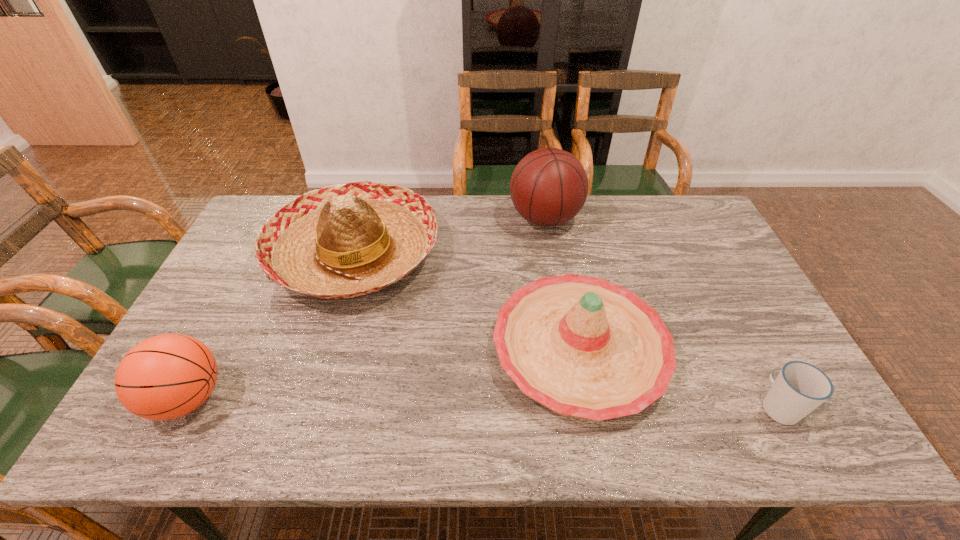
What are the coordinates of `blank space that satisfies the following two spatial constraints: 1. on the back side of the farther basketball; 2. on the left side of the left sombrero` in the screenshot? It's located at (365, 218).